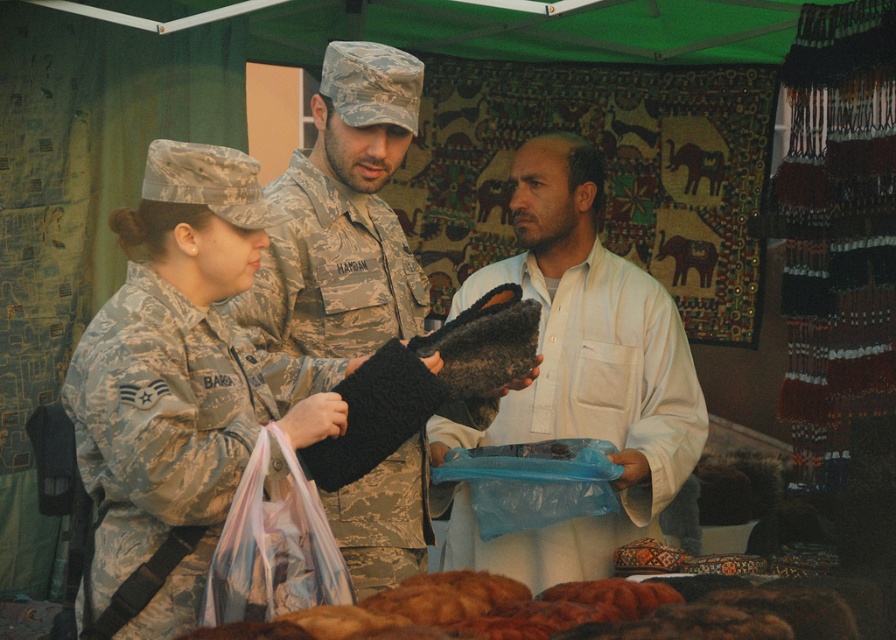
You are a vendor at the market and want to place the fuzzy brown bread at lower center on the table next to the camouflage fabric uniform at center. Since the table is small, will the bread fit next to the uniform?

The camouflage fabric uniform at center has a larger size compared to fuzzy brown bread at lower center, so the bread will fit next to the uniform on the table since it is smaller in size.

You are a tailor in this market and need to determine if the white cotton shirt at center can fit into a storage box designed for the camouflage fabric uniform at center. Given their sizes, will the shirt fit?

The white cotton shirt at center has a larger size compared to the camouflage fabric uniform at center, so it may not fit into the storage box designed for the smaller uniform.

You are a delivery robot with a width of 50 centimeters. You need to move from your current position to the fuzzy brown bread at lower center while avoiding the camouflage fabric uniform at center. Is there enough space for you to pass through the gap between them?

The distance between the camouflage fabric uniform at center and the fuzzy brown bread at lower center is 59.91 centimeters. Since the robot is 50 centimeters wide, there is sufficient space for it to pass through the gap.